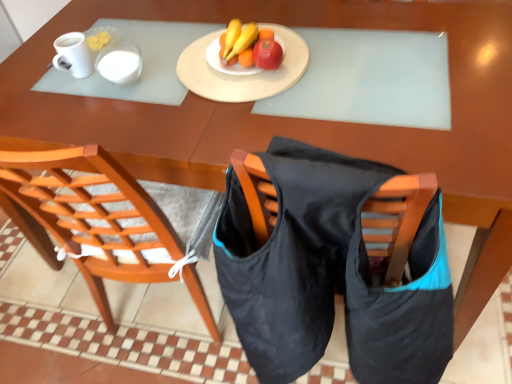
I want to click on vacant region in front of matte yellow banana at center, so click(x=274, y=99).